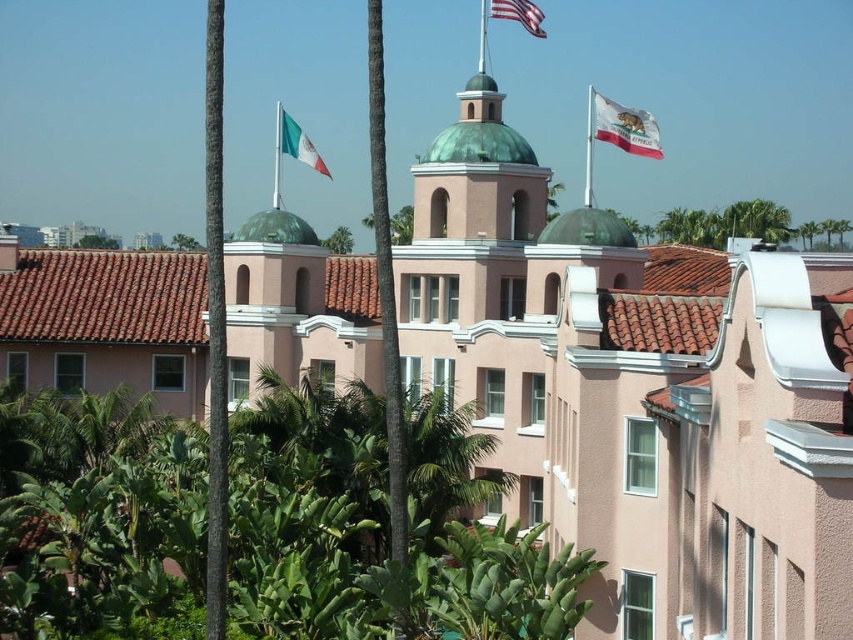
Can you confirm if white fabric flag at upper right is bigger than green fabric flag at upper center?

Incorrect, white fabric flag at upper right is not larger than green fabric flag at upper center.

Can you confirm if white fabric flag at upper right is positioned to the right of green fabric flag at upper center?

Yes, white fabric flag at upper right is to the right of green fabric flag at upper center.

Locate an element on the screen. The image size is (853, 640). white fabric flag at upper right is located at coordinates (625, 128).

You are a GUI agent. You are given a task and a screenshot of the screen. Output one action in this format:
    pyautogui.click(x=<x>, y=<y>)
    Task: Click on the white fabric flag at upper right
    
    Given the screenshot: What is the action you would take?
    pyautogui.click(x=625, y=128)

Between point (601, 100) and point (491, 1), which one is positioned in front?

Point (601, 100) is more forward.

How far apart are white fabric flag at upper right and american flag at upper center?

28.87 feet

Does point (612, 138) come closer to viewer compared to point (537, 33)?

Yes, point (612, 138) is in front of point (537, 33).

Where is `white fabric flag at upper right`? white fabric flag at upper right is located at coordinates (625, 128).

Between point (294, 136) and point (515, 16), which one is positioned in front?

Point (515, 16) is more forward.

Does green fabric flag at upper center have a smaller size compared to american flag at upper center?

No.

In order to click on green fabric flag at upper center in this screenshot , I will do `click(299, 144)`.

The image size is (853, 640). I want to click on green fabric flag at upper center, so click(299, 144).